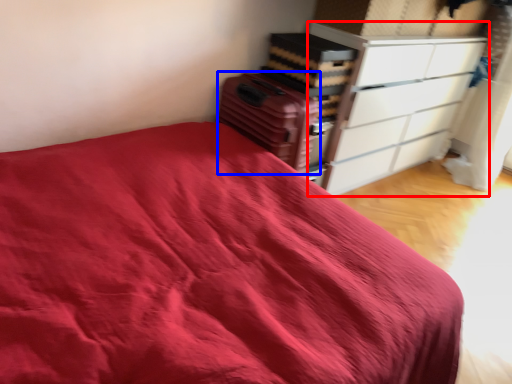
Question: Which point is closer to the camera, chest of drawers (highlighted by a red box) or luggage (highlighted by a blue box)?

Choices:
 (A) chest of drawers
 (B) luggage

Answer: (B)